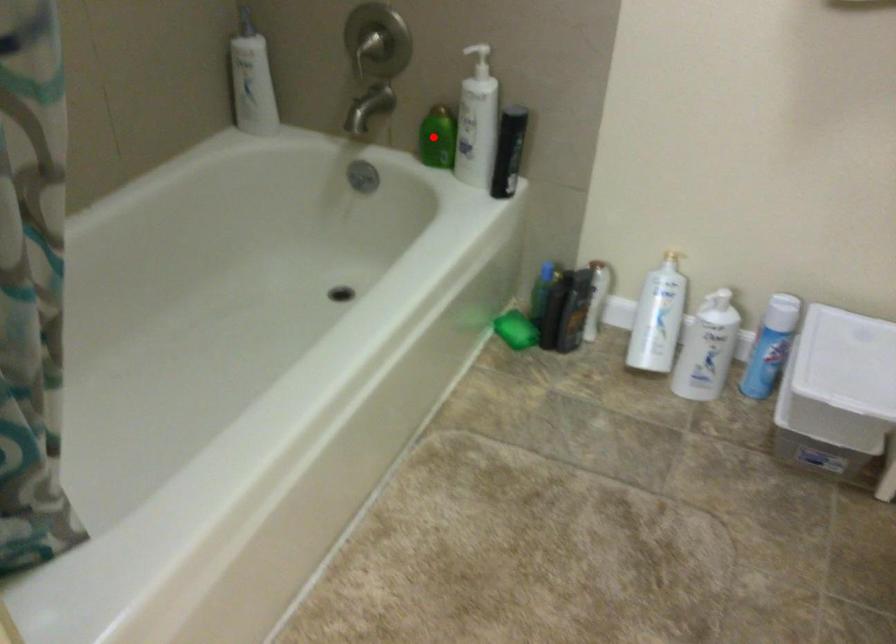
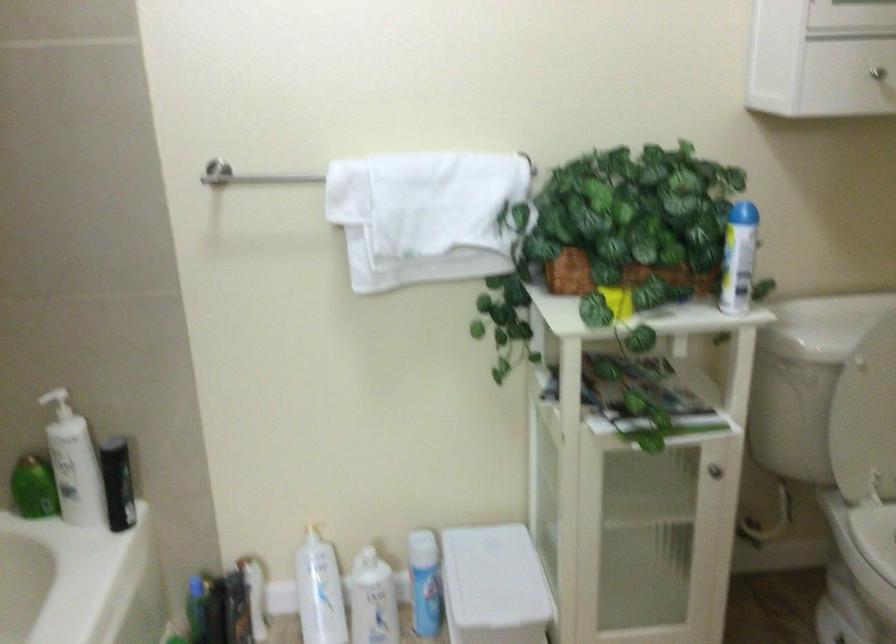
Question: I am providing you with two images of the same scene from different viewpoints. A red point is marked on the first image. At the location where the point appears in image 1, is it still visible in image 2?

Choices:
 (A) Yes
 (B) No

Answer: (A)